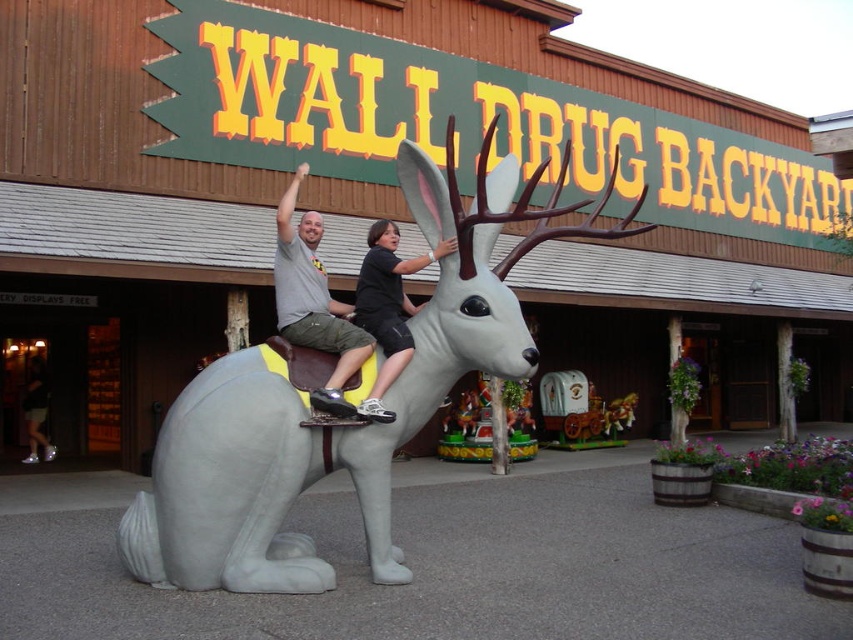
You are a photographer trying to capture a photo of the matte gray rabbit at center and the black matte shirt at center. Which object should you focus on first if you want to ensure both are in the frame without moving the camera?

The matte gray rabbit at center is larger in size than the black matte shirt at center, so you should focus on the matte gray rabbit at center first to ensure it fits within the frame before adjusting for the smaller object.

You are a photographer trying to capture a photo of the gray matte deer at center and the black matte shirt at center. If you want to ensure both are fully visible in the frame, which object should you focus on to avoid cropping?

Since the gray matte deer at center is wider than the black matte shirt at center, you should focus on the gray matte deer at center to ensure it fits entirely in the frame without cropping.